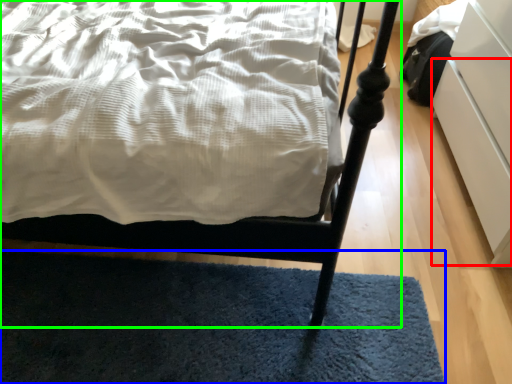
Question: Which object is positioned farthest from drawer (highlighted by a red box)? Select from mat (highlighted by a blue box) and bed (highlighted by a green box).

Choices:
 (A) mat
 (B) bed

Answer: (B)